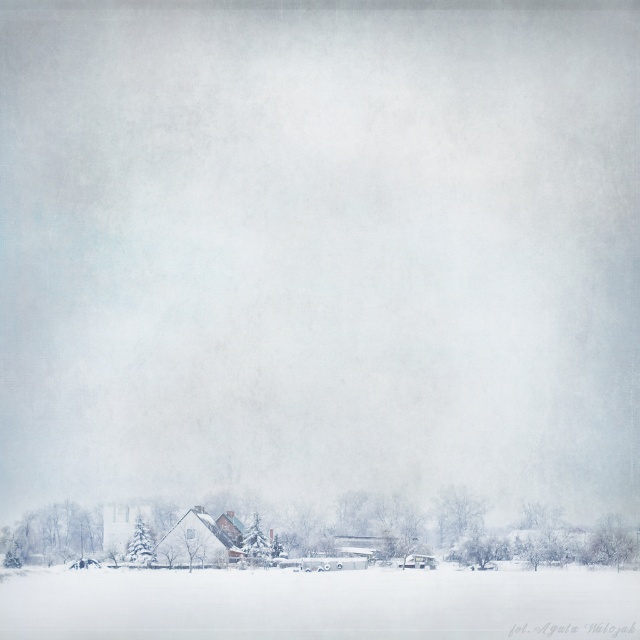
The height and width of the screenshot is (640, 640). Describe the element at coordinates (51, 534) in the screenshot. I see `snow-covered tree at lower left` at that location.

Which is in front, point (97, 545) or point (620, 528)?

Point (620, 528) is in front.

Does point (74, 548) come farther from viewer compared to point (593, 561)?

Yes, it is behind point (593, 561).

You are a GUI agent. You are given a task and a screenshot of the screen. Output one action in this format:
    pyautogui.click(x=<x>, y=<y>)
    Task: Click on the snow-covered tree at lower left
    
    Given the screenshot: What is the action you would take?
    pyautogui.click(x=51, y=534)

Image resolution: width=640 pixels, height=640 pixels. What do you see at coordinates (458, 513) in the screenshot?
I see `snow-covered tree at lower center` at bounding box center [458, 513].

Which is more to the left, snow-covered tree at lower center or green matte tree at lower left?

From the viewer's perspective, green matte tree at lower left appears more on the left side.

The height and width of the screenshot is (640, 640). Find the location of `snow-covered tree at lower center`. snow-covered tree at lower center is located at coordinates (458, 513).

At what (x,y) coordinates should I click in order to perform the action: click on snow-covered tree at lower center. Please return your answer as a coordinate pair (x, y). The height and width of the screenshot is (640, 640). Looking at the image, I should click on (458, 513).

Does point (470, 628) come behind point (461, 496)?

That is False.

Is white snowfield at lower center positioned behind snow-covered tree at lower center?

No, white snowfield at lower center is in front of snow-covered tree at lower center.

Between point (76, 625) and point (477, 528), which one is positioned in front?

Point (76, 625)

What are the coordinates of `white snowfield at lower center` in the screenshot? It's located at (317, 602).